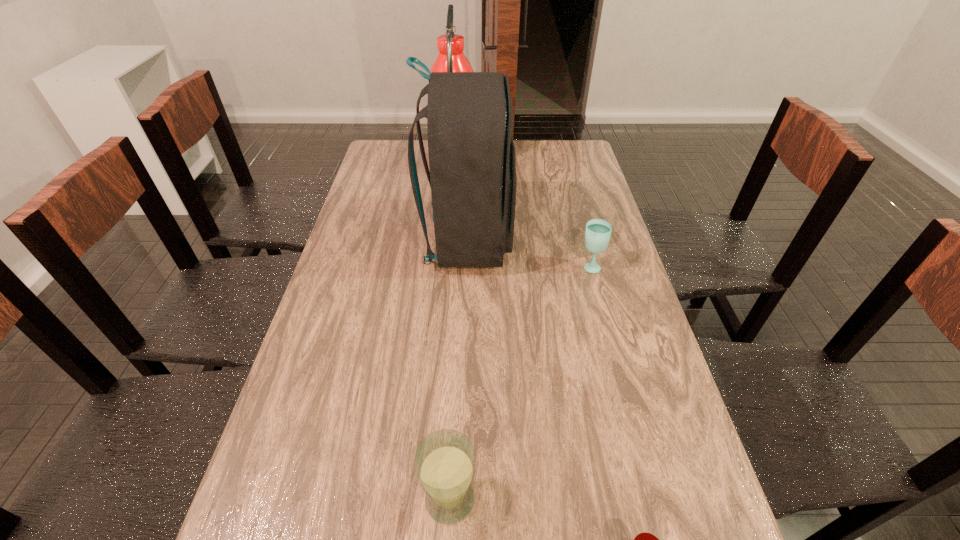
At what (x,y) coordinates should I click in order to perform the action: click on free spot between the backpack and the second tallest glass. Please return your answer as a coordinate pair (x, y). The height and width of the screenshot is (540, 960). Looking at the image, I should click on (529, 254).

Find the location of `free space between the farthest object and the second shortest object`. free space between the farthest object and the second shortest object is located at coordinates (522, 217).

Locate which object ranks in proximity to the backpack. Please provide its 2D coordinates. Your answer should be formatted as a tuple, i.e. [(x, y)], where the tuple contains the x and y coordinates of a point satisfying the conditions above.

[(451, 58)]

Select which object appears as the fourth closest to the leftmost glass. Please provide its 2D coordinates. Your answer should be formatted as a tuple, i.e. [(x, y)], where the tuple contains the x and y coordinates of a point satisfying the conditions above.

[(451, 58)]

Identify which glass is the second nearest to the second glass from left to right. Please provide its 2D coordinates. Your answer should be formatted as a tuple, i.e. [(x, y)], where the tuple contains the x and y coordinates of a point satisfying the conditions above.

[(598, 231)]

The width and height of the screenshot is (960, 540). What are the coordinates of `glass that stands as the second closest to the backpack` in the screenshot? It's located at (445, 461).

This screenshot has width=960, height=540. In order to click on vacant space that satisfies the following two spatial constraints: 1. on the front-facing side of the backpack; 2. on the back side of the rightmost object in this screenshot , I will do `click(468, 266)`.

Locate an element on the screen. free space that satisfies the following two spatial constraints: 1. on the back side of the rightmost glass; 2. on the front-facing side of the backpack is located at coordinates (584, 241).

Locate an element on the screen. This screenshot has height=540, width=960. blank area in the image that satisfies the following two spatial constraints: 1. on the label side of the second shortest glass; 2. on the left side of the farthest object is located at coordinates (447, 266).

Where is `free spot that satisfies the following two spatial constraints: 1. on the front-facing side of the farthest glass; 2. on the right side of the backpack`? The width and height of the screenshot is (960, 540). free spot that satisfies the following two spatial constraints: 1. on the front-facing side of the farthest glass; 2. on the right side of the backpack is located at coordinates (468, 266).